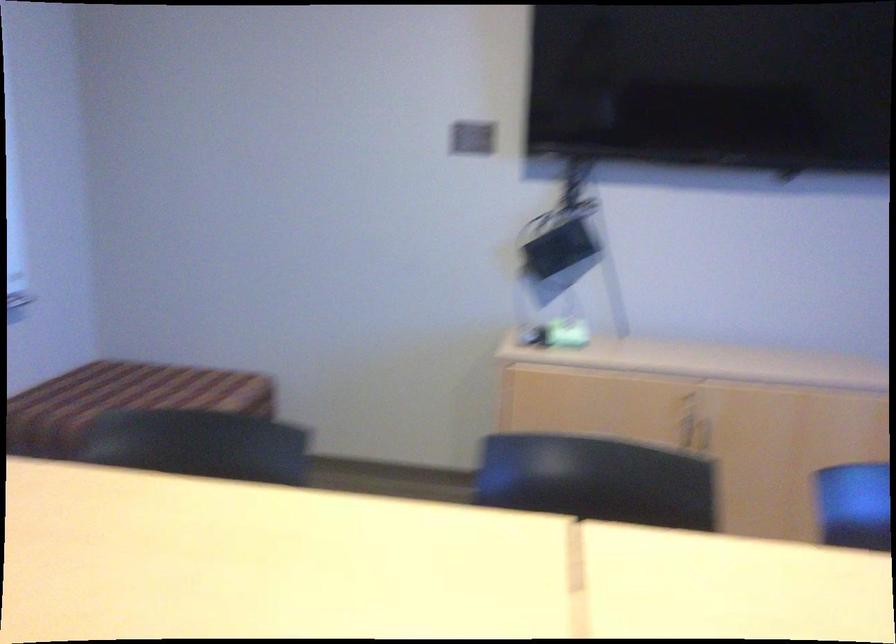
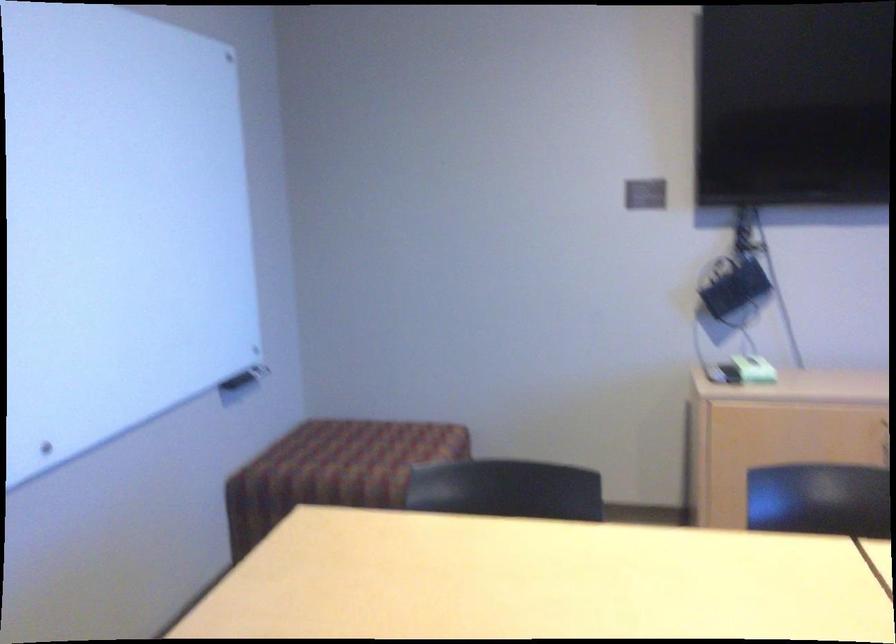
Find the pixel in the second image that matches point (564, 330) in the first image.

(754, 368)